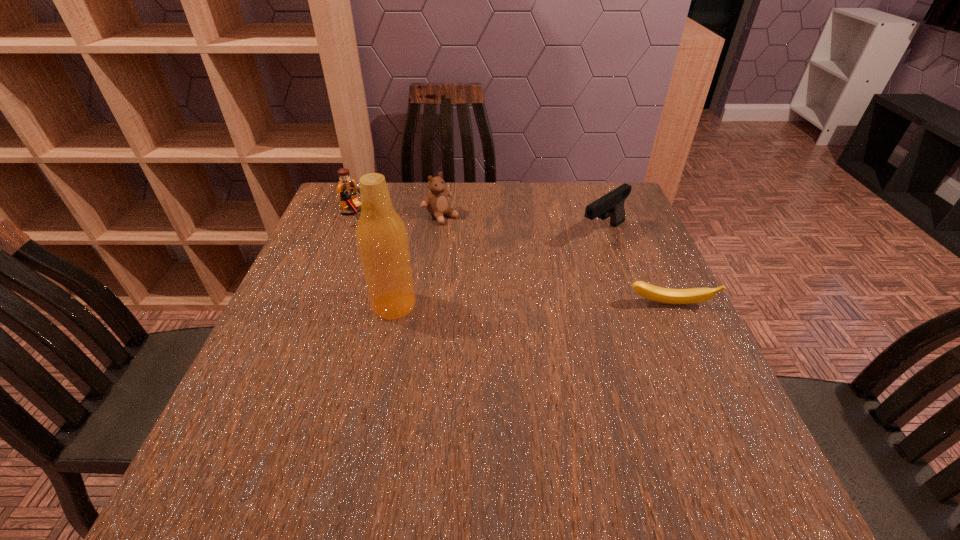
The image size is (960, 540). I want to click on vacant space on the desktop that is between the beer bottle and the banana and is positioned on the front-facing side of the teddy bear, so click(x=566, y=305).

You are a GUI agent. You are given a task and a screenshot of the screen. Output one action in this format:
    pyautogui.click(x=<x>, y=<y>)
    Task: Click on the vacant space on the desktop that is between the tallest object and the banana and is positioned holding a crossbow in the hands of the leftmost object
    This screenshot has width=960, height=540.
    Given the screenshot: What is the action you would take?
    498,305

At what (x,y) coordinates should I click in order to perform the action: click on vacant spot on the desktop that is between the tallest object and the banana and is positioned on the front-facing side of the pistol. Please return your answer as a coordinate pair (x, y). Image resolution: width=960 pixels, height=540 pixels. Looking at the image, I should click on (496, 305).